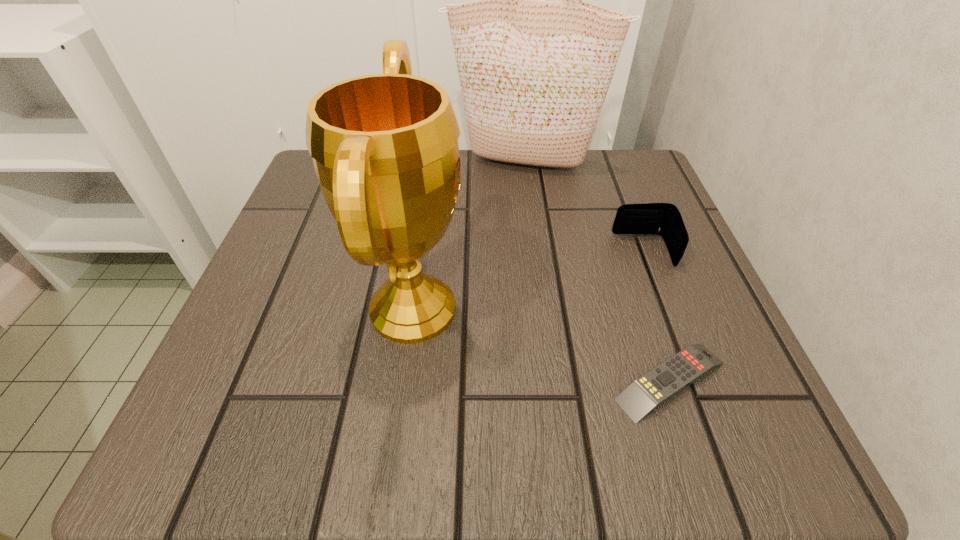
Identify the location of free location at the near edge. (538, 418).

This screenshot has height=540, width=960. What are the coordinates of `vacant space at the left edge of the desktop` in the screenshot? It's located at (228, 334).

Find the location of a particular element. The height and width of the screenshot is (540, 960). vacant space at the right edge is located at coordinates (600, 221).

At what (x,y) coordinates should I click in order to perform the action: click on vacant space at the near left corner of the desktop. Please return your answer as a coordinate pair (x, y). This screenshot has width=960, height=540. Looking at the image, I should click on (252, 400).

The image size is (960, 540). Identify the location of vacant space at the far right corner of the desktop. (593, 205).

Identify the location of vacant region at the near right corner of the desktop. The height and width of the screenshot is (540, 960). (763, 449).

At what (x,y) coordinates should I click in order to perform the action: click on free space between the remote control and the wallet. Please return your answer as a coordinate pair (x, y). This screenshot has height=540, width=960. Looking at the image, I should click on pyautogui.click(x=657, y=316).

Locate an element on the screen. Image resolution: width=960 pixels, height=540 pixels. vacant area that lies between the wallet and the shortest object is located at coordinates (657, 316).

Identify the location of vacant area that lies between the second tallest object and the tallest object. (468, 235).

Where is `vacant area that lies between the award and the shopping bag`? vacant area that lies between the award and the shopping bag is located at coordinates (468, 235).